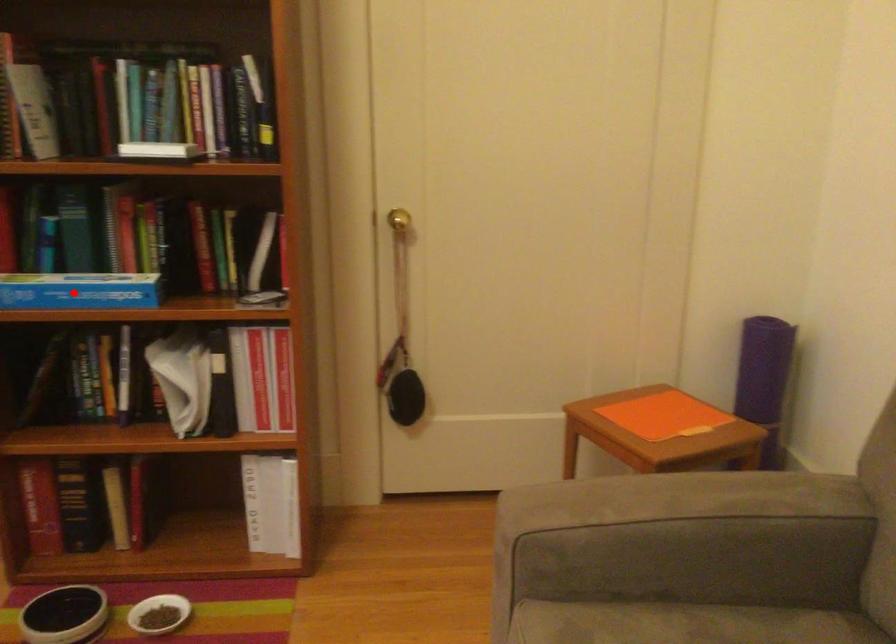
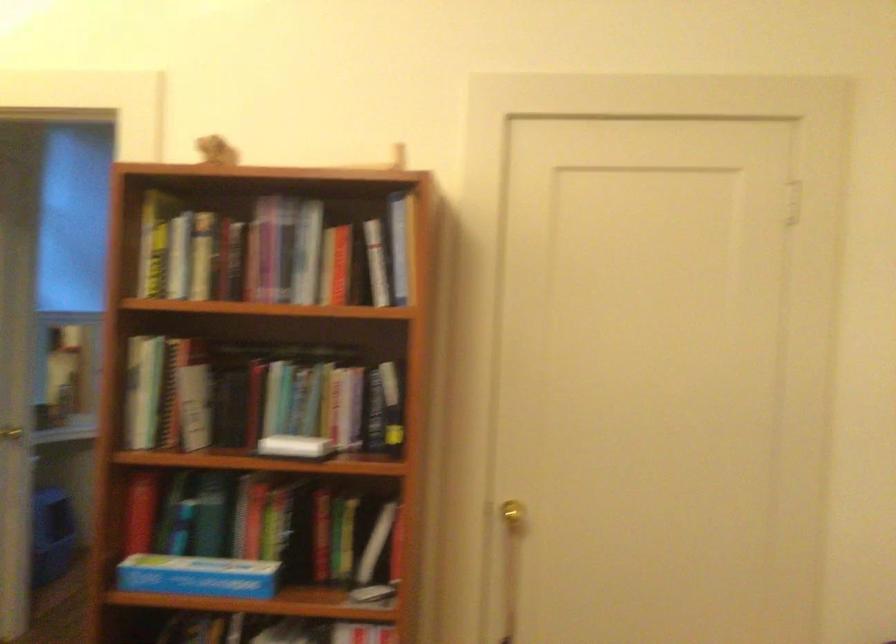
Find the pixel in the second image that matches the highlighted location in the first image.

(197, 576)